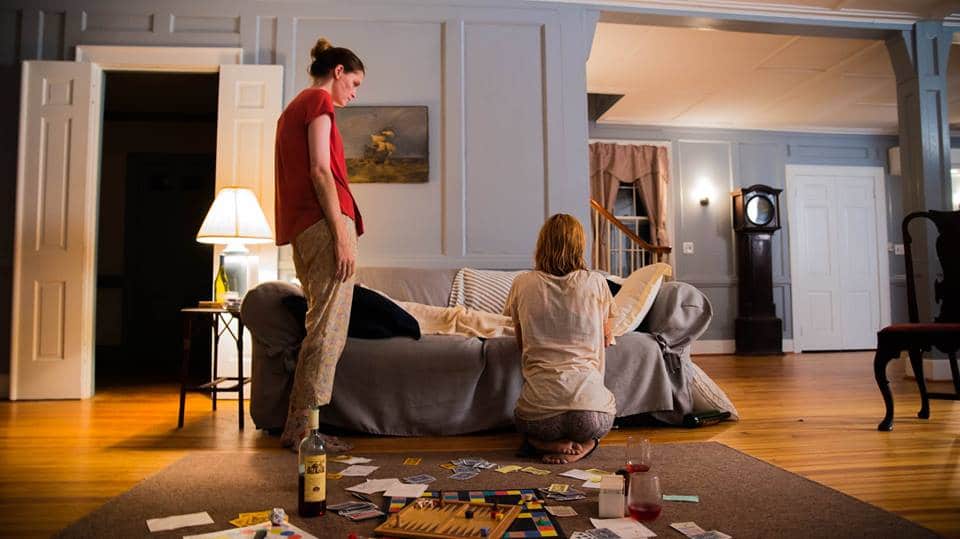
The height and width of the screenshot is (539, 960). Find the location of `board game`. board game is located at coordinates (506, 497).